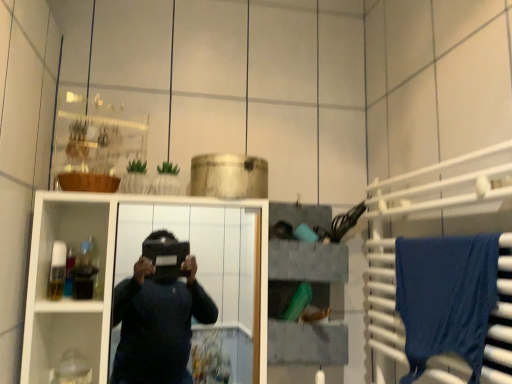
Question: Is blue fabric at right spatially inside blue fabric towel at right, or outside of it?

Choices:
 (A) outside
 (B) inside

Answer: (B)

Question: Would you say blue fabric at right is to the left or to the right of blue fabric towel at right in the picture?

Choices:
 (A) right
 (B) left

Answer: (A)

Question: Which is nearer to the blue fabric at right?

Choices:
 (A) white glossy cabinet at center
 (B) blue fabric towel at right
 (C) gray fabric storage at upper center

Answer: (B)

Question: Based on their relative distances, which object is farther from the blue fabric at right?

Choices:
 (A) white glossy cabinet at center
 (B) blue fabric towel at right
 (C) gray fabric storage at upper center

Answer: (A)